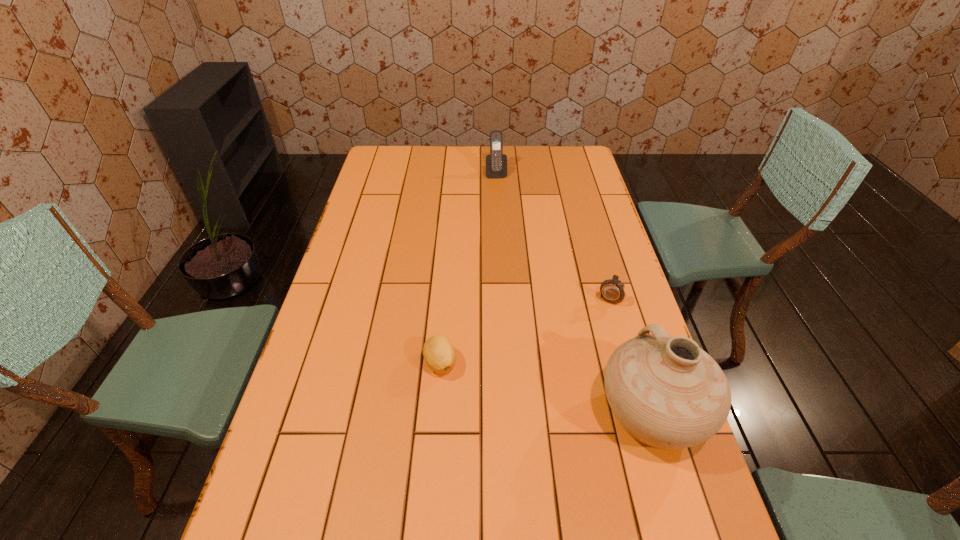
The height and width of the screenshot is (540, 960). What are the coordinates of `free point located on the face of the third nearest object` in the screenshot? It's located at (561, 387).

Image resolution: width=960 pixels, height=540 pixels. In order to click on vacant region located 0.060m on the face of the third nearest object in this screenshot , I will do `click(599, 319)`.

Identify the location of vacant space located on the front-facing side of the third shortest object. This screenshot has height=540, width=960. [506, 234].

The width and height of the screenshot is (960, 540). I want to click on free space located 0.120m on the front-facing side of the third shortest object, so click(500, 195).

You are a GUI agent. You are given a task and a screenshot of the screen. Output one action in this format:
    pyautogui.click(x=<x>, y=<y>)
    Task: Click on the vacant space located on the front-facing side of the third shortest object
    Image resolution: width=960 pixels, height=540 pixels.
    Given the screenshot: What is the action you would take?
    pyautogui.click(x=500, y=195)

Where is `object located in the far edge section of the desktop`? This screenshot has height=540, width=960. object located in the far edge section of the desktop is located at coordinates (496, 163).

Find the location of a particular element. Image resolution: width=960 pixels, height=540 pixels. pottery that is at the right edge is located at coordinates (667, 392).

This screenshot has height=540, width=960. Find the location of `compass located at the right edge`. compass located at the right edge is located at coordinates coord(612,291).

This screenshot has width=960, height=540. In order to click on blank space at the far edge of the desktop in this screenshot , I will do `click(471, 174)`.

You are a GUI agent. You are given a task and a screenshot of the screen. Output one action in this format:
    pyautogui.click(x=<x>, y=<y>)
    Task: Click on the vacant space at the left edge
    
    Given the screenshot: What is the action you would take?
    pyautogui.click(x=372, y=207)